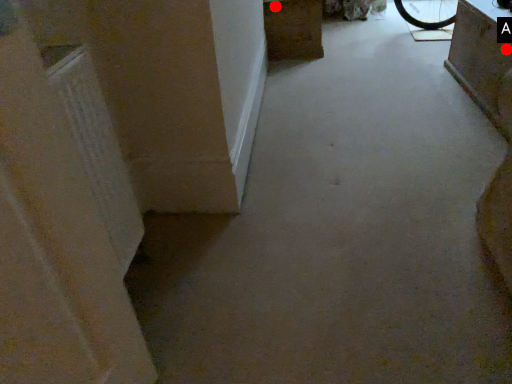
Question: Two points are circled on the image, labeled by A and B beside each circle. Which point is farther to the camera?

Choices:
 (A) A is further
 (B) B is further

Answer: (B)